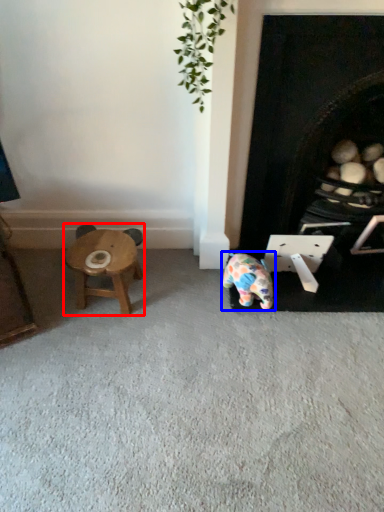
Question: Which object is further to the camera taking this photo, stool (highlighted by a red box) or toy (highlighted by a blue box)?

Choices:
 (A) stool
 (B) toy

Answer: (A)